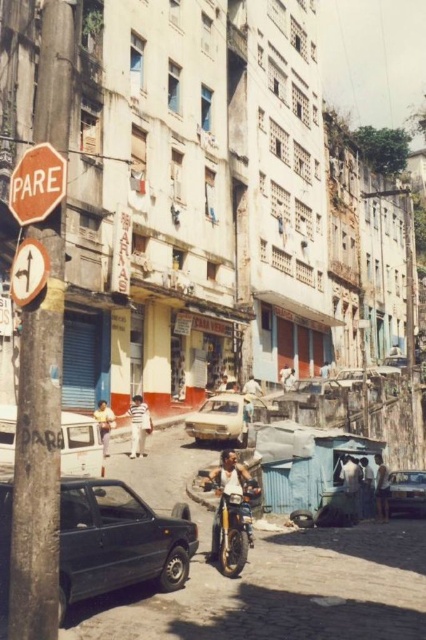
Who is taller, red matte stop sign at left or light blue shirt at center?

red matte stop sign at left

Looking at this image, which of these two, red matte stop sign at left or light blue shirt at center, stands shorter?

With less height is light blue shirt at center.

Who is more distant from viewer, (40, 218) or (98, 401)?

Positioned behind is point (98, 401).

Locate an element on the screen. red matte stop sign at left is located at coordinates (37, 184).

Is light blue shirt at center thinner than light brown leather jacket at center?

Indeed, light blue shirt at center has a lesser width compared to light brown leather jacket at center.

Describe the element at coordinates (104, 422) in the screenshot. Image resolution: width=426 pixels, height=640 pixels. I see `light blue shirt at center` at that location.

Who is more forward, (112, 420) or (250, 378)?

Positioned in front is point (112, 420).

At what (x,y) coordinates should I click in order to perform the action: click on light blue shirt at center. Please return your answer as a coordinate pair (x, y). The height and width of the screenshot is (640, 426). Looking at the image, I should click on point(104,422).

Can you confirm if shiny chrome motorcycle at center is positioned above dark blue shirt at center?

Indeed, shiny chrome motorcycle at center is positioned over dark blue shirt at center.

Does point (219, 504) come closer to viewer compared to point (344, 477)?

Yes, it is.

Is point (242, 554) behind point (353, 499)?

No, (242, 554) is closer to viewer.

Identify the location of shiny chrome motorcycle at center. The width and height of the screenshot is (426, 640). (233, 522).